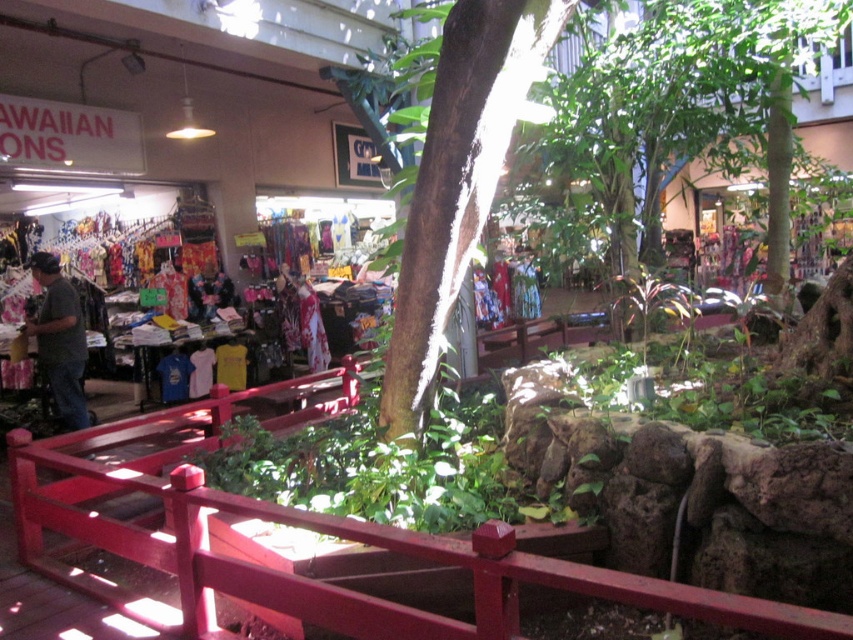
Is smooth wood bridge at center wider than dark gray t-shirt at left?

Yes.

This screenshot has height=640, width=853. What do you see at coordinates (318, 532) in the screenshot?
I see `smooth wood bridge at center` at bounding box center [318, 532].

I want to click on smooth wood bridge at center, so click(318, 532).